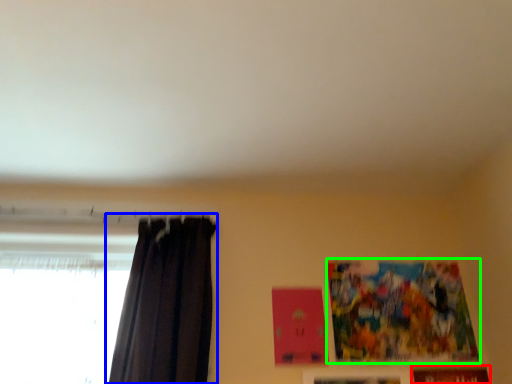
Question: Which is nearer to the picture frame (highlighted by a red box)? curtain (highlighted by a blue box) or picture frame (highlighted by a green box).

Choices:
 (A) curtain
 (B) picture frame

Answer: (B)